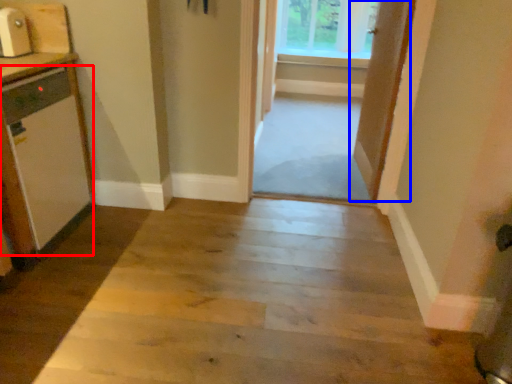
Question: Among these objects, which one is nearest to the camera, appliance (highlighted by a red box) or door (highlighted by a blue box)?

Choices:
 (A) appliance
 (B) door

Answer: (A)